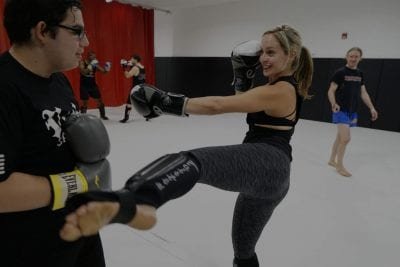
You are a GUI agent. You are given a task and a screenshot of the screen. Output one action in this format:
    pyautogui.click(x=<x>, y=<y>)
    Task: Click on the white floor
    The width and height of the screenshot is (400, 267).
    Given the screenshot: What is the action you would take?
    pyautogui.click(x=172, y=135)